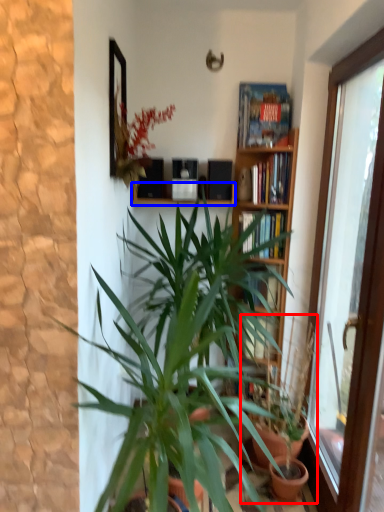
Question: Which object is closer to the camera taking this photo, houseplant (highlighted by a red box) or window sill (highlighted by a blue box)?

Choices:
 (A) houseplant
 (B) window sill

Answer: (A)